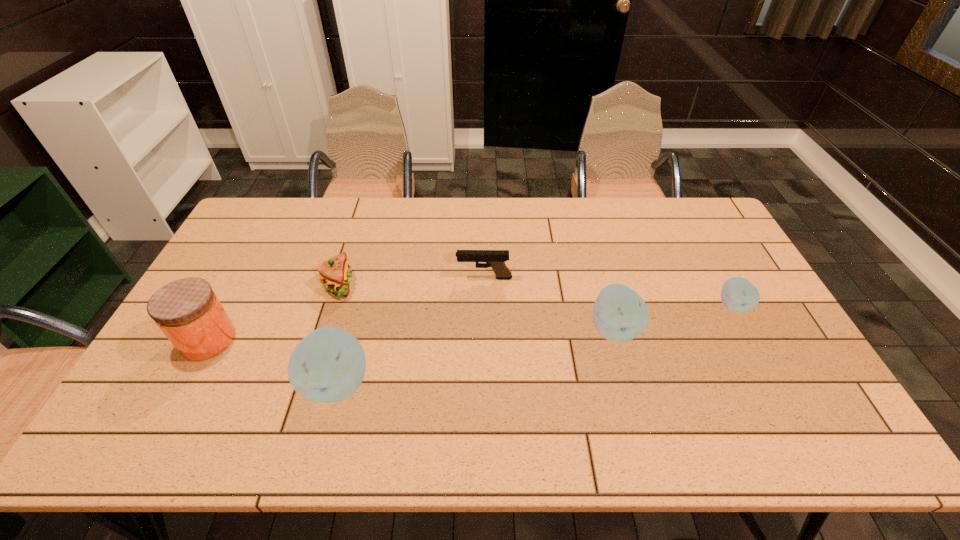
Image resolution: width=960 pixels, height=540 pixels. Identify the location of free point between the sandwich and the shortest apple. (536, 295).

Select which object appears as the second closest to the fourth object from left to right. Please provide its 2D coordinates. Your answer should be formatted as a tuple, i.e. [(x, y)], where the tuple contains the x and y coordinates of a point satisfying the conditions above.

[(335, 274)]

Locate an element on the screen. object that is the fifth closest one to the sandwich is located at coordinates (738, 295).

Locate an element on the screen. The image size is (960, 540). apple that is the third closest to the leftmost object is located at coordinates (738, 295).

Locate an element on the screen. apple that stands as the closest to the leftmost apple is located at coordinates (619, 314).

Find the location of a particular element. free space that satisfies the following two spatial constraints: 1. on the back side of the sandwich; 2. on the left side of the jar is located at coordinates coord(238,285).

The width and height of the screenshot is (960, 540). I want to click on free space that satisfies the following two spatial constraints: 1. on the front side of the leftmost apple; 2. on the left side of the jar, so click(185, 383).

Find the location of a particular element. The height and width of the screenshot is (540, 960). free space that satisfies the following two spatial constraints: 1. on the front-facing side of the pistol; 2. on the right side of the rightmost apple is located at coordinates (485, 306).

Find the location of a particular element. vacant space that satisfies the following two spatial constraints: 1. on the front side of the second apple from left to right; 2. on the left side of the sandwich is located at coordinates (325, 329).